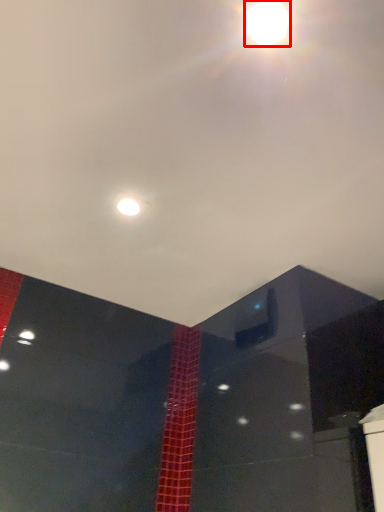
Question: From the image's perspective, what is the correct spatial positioning of lamp (annotated by the red box) in reference to light?

Choices:
 (A) below
 (B) above

Answer: (B)